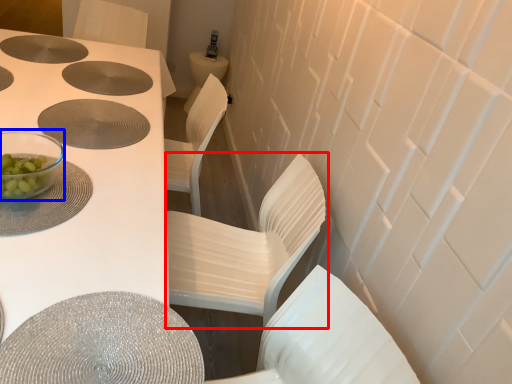
Question: Which object appears farthest to the camera in this image, chair (highlighted by a red box) or tableware (highlighted by a blue box)?

Choices:
 (A) chair
 (B) tableware

Answer: (A)